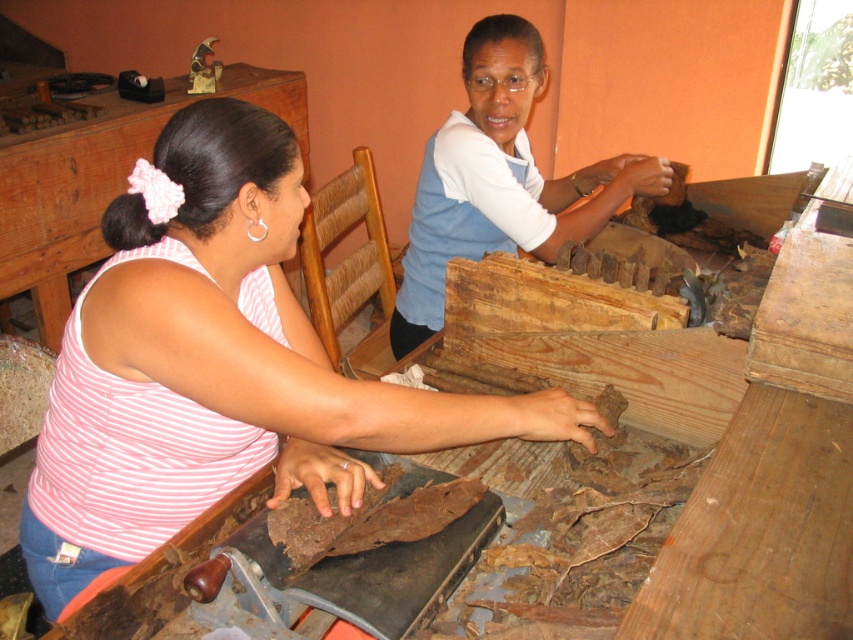
Can you confirm if pink striped tank top at center is wider than blue cotton shirt at upper center?

Indeed, pink striped tank top at center has a greater width compared to blue cotton shirt at upper center.

Between pink striped tank top at center and blue cotton shirt at upper center, which one is positioned higher?

blue cotton shirt at upper center

Locate an element on the screen. The image size is (853, 640). pink striped tank top at center is located at coordinates click(218, 364).